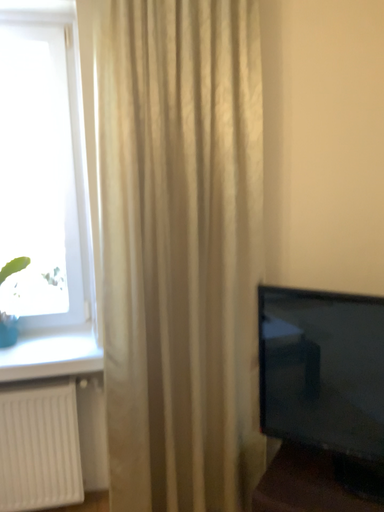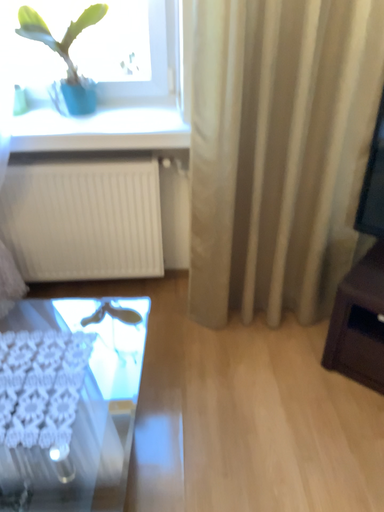
Question: Which way did the camera rotate in the video?

Choices:
 (A) rotated right
 (B) rotated left

Answer: (B)